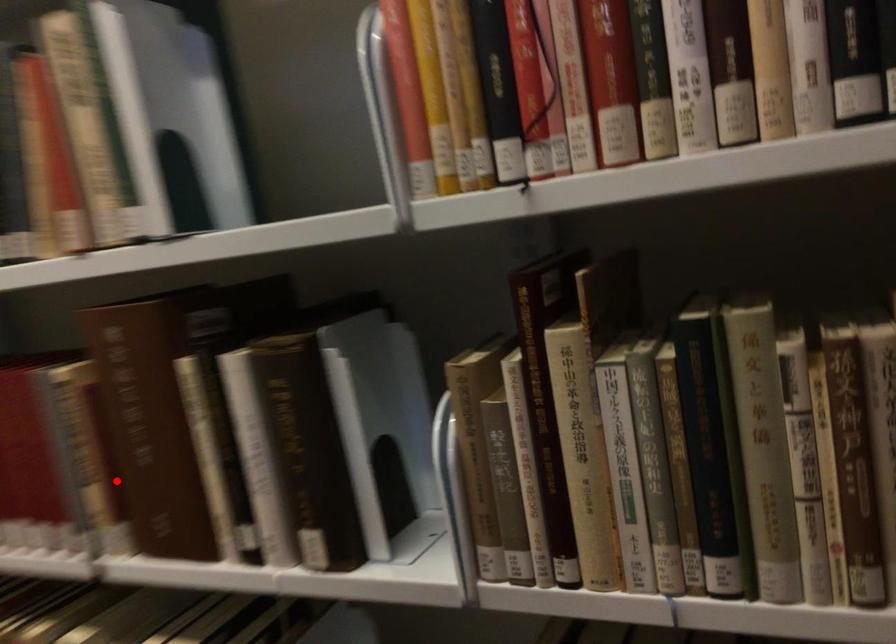
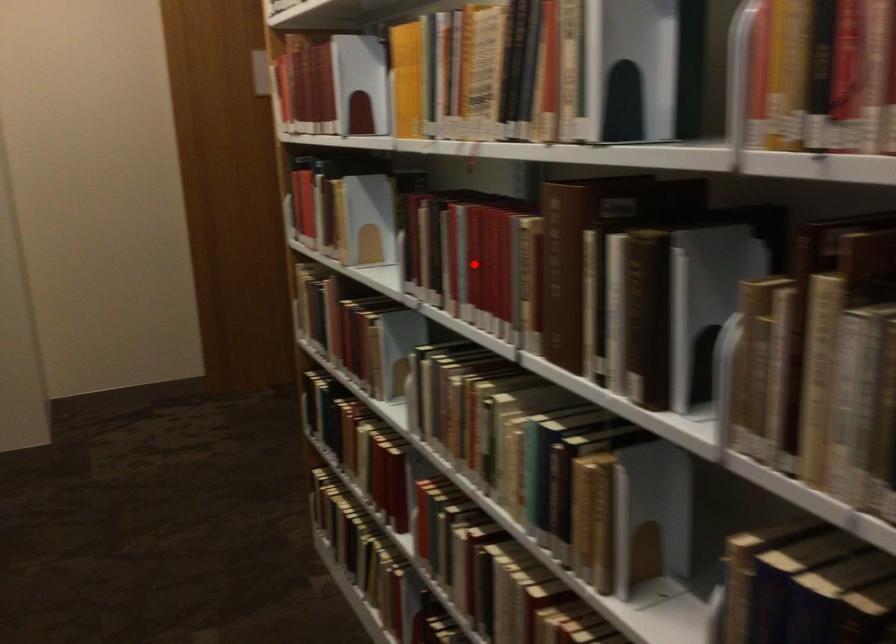
I am providing you with two images of the same scene from different viewpoints. A red point is marked on the first image and another point is marked on the second image. Does the point marked in image1 correspond to the same location as the one in image2?

No